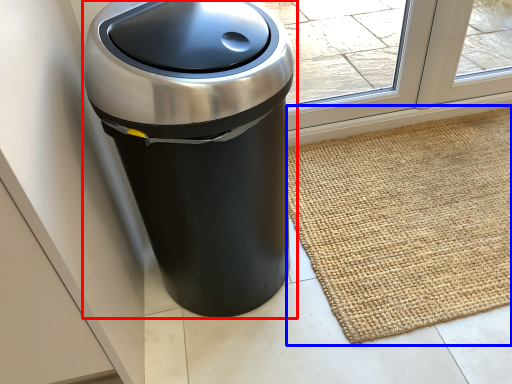
Question: Which point is further to the camera, waste container (highlighted by a red box) or doormat (highlighted by a blue box)?

Choices:
 (A) waste container
 (B) doormat

Answer: (B)